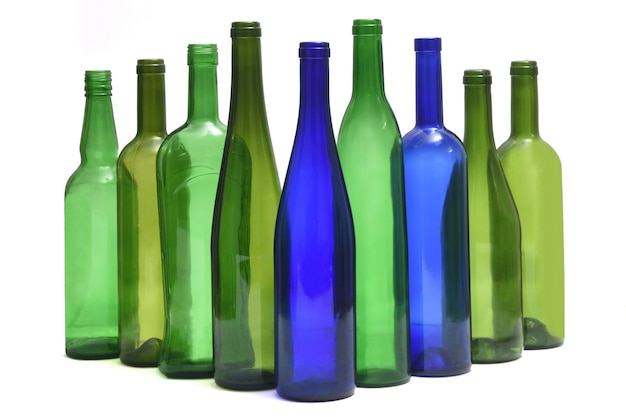
Where is `bottles`? The width and height of the screenshot is (626, 417). bottles is located at coordinates click(91, 225), click(148, 215), click(195, 207), click(245, 201), click(319, 203), click(377, 191), click(436, 193), click(486, 198), click(546, 196).